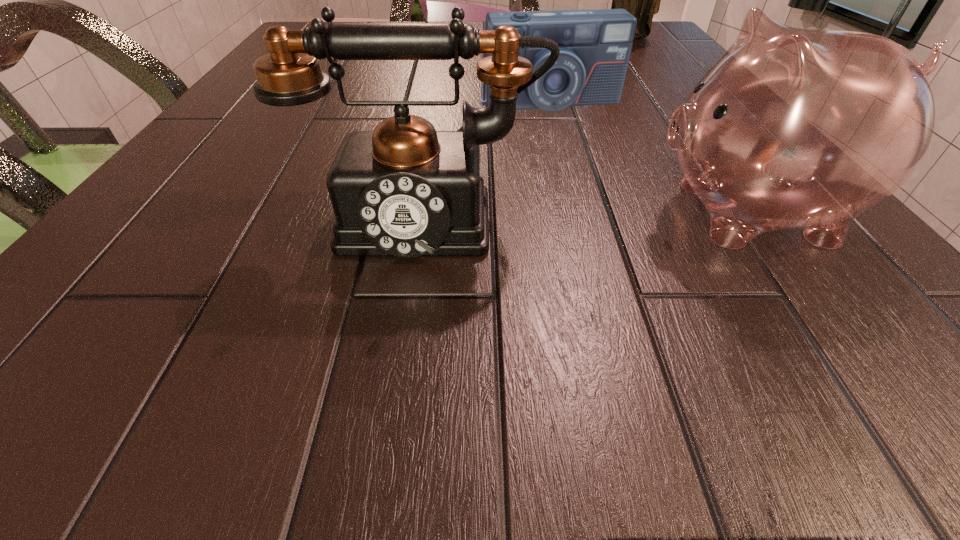
This screenshot has width=960, height=540. Identify the location of telephone. (406, 190).

Where is `piggy bank`? piggy bank is located at coordinates (791, 128).

Identify the location of the second farthest object. (595, 46).

Locate an element on the screen. camera is located at coordinates (595, 46).

You are a GUI agent. You are given a task and a screenshot of the screen. Output one action in this format:
    pyautogui.click(x=<x>, y=<y>)
    Task: Click on the tallest object
    The height and width of the screenshot is (540, 960).
    Given the screenshot: What is the action you would take?
    pyautogui.click(x=642, y=0)

At what (x,y) coordinates should I click in order to perform the action: click on the farthest object. Please return your answer as a coordinate pair (x, y). Image resolution: width=960 pixels, height=540 pixels. Looking at the image, I should click on (642, 0).

Locate an element on the screen. The height and width of the screenshot is (540, 960). vacant space located on the front facing side of the piggy bank is located at coordinates (486, 212).

Where is `vacant area situated on the front facing side of the piggy bank`? This screenshot has width=960, height=540. vacant area situated on the front facing side of the piggy bank is located at coordinates (532, 212).

The height and width of the screenshot is (540, 960). I want to click on vacant point located 0.380m on the front facing side of the piggy bank, so click(x=354, y=212).

You are a GUI agent. You are given a task and a screenshot of the screen. Output one action in this format:
    pyautogui.click(x=<x>, y=<y>)
    Task: Click on the vacant space located on the lens of the shortest object
    
    Given the screenshot: What is the action you would take?
    pyautogui.click(x=617, y=227)